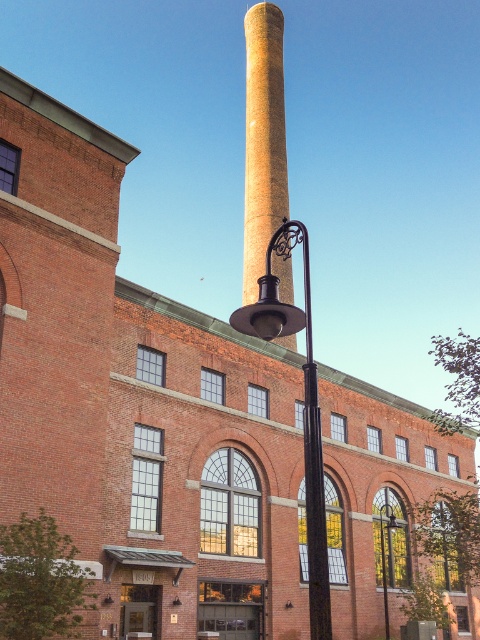
Is yellowish brick chimney at center to the left of matte black lamp post at center from the viewer's perspective?

Indeed, yellowish brick chimney at center is positioned on the left side of matte black lamp post at center.

Does yellowish brick chimney at center appear on the right side of matte black lamp post at center?

Incorrect, yellowish brick chimney at center is not on the right side of matte black lamp post at center.

In order to click on yellowish brick chimney at center in this screenshot , I will do `click(263, 140)`.

Who is more distant from viewer, (253, 257) or (260, 308)?

The point (253, 257) is behind.

What do you see at coordinates (263, 140) in the screenshot? Image resolution: width=480 pixels, height=640 pixels. I see `yellowish brick chimney at center` at bounding box center [263, 140].

Is point (264, 180) positioned in front of point (289, 243)?

No, it is not.

The height and width of the screenshot is (640, 480). I want to click on yellowish brick chimney at center, so click(263, 140).

Who is positioned more to the right, polished brass lamp post at center or matte black lamp post at center?

matte black lamp post at center is more to the right.

Which is in front, point (265, 333) or point (381, 532)?

Positioned in front is point (265, 333).

Describe the element at coordinates (303, 406) in the screenshot. The height and width of the screenshot is (640, 480). I see `polished brass lamp post at center` at that location.

I want to click on polished brass lamp post at center, so click(x=303, y=406).